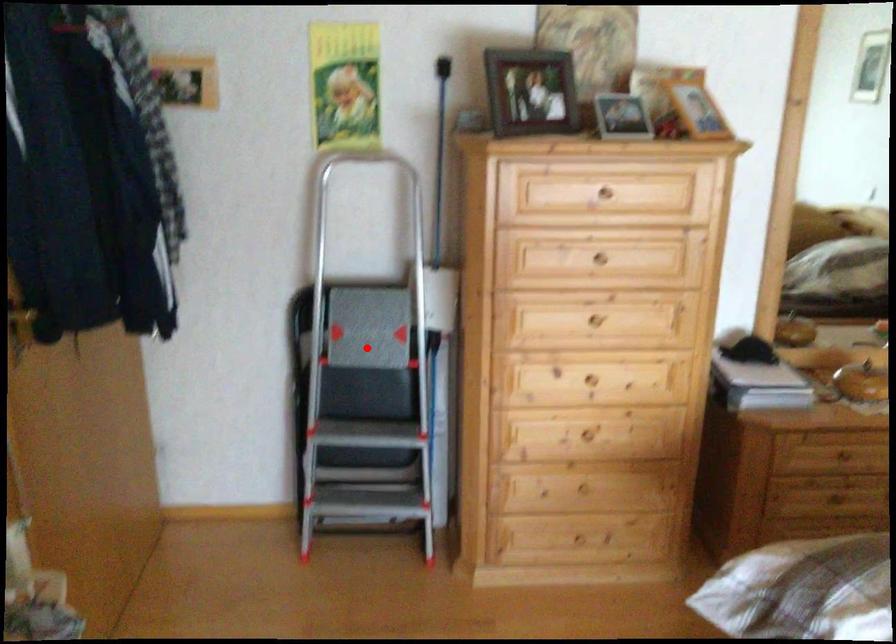
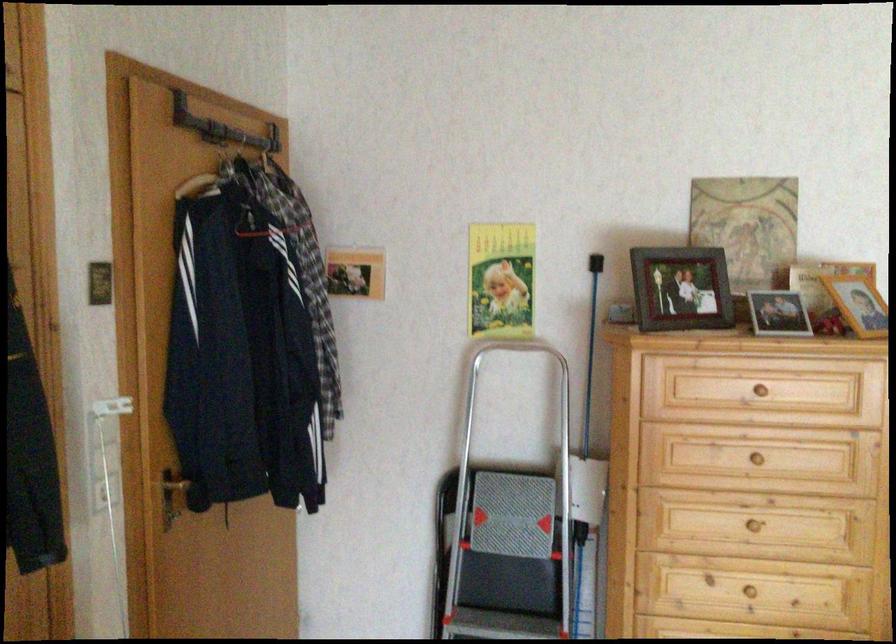
Find the pixel in the second image that matches the highlighted location in the first image.

(510, 536)